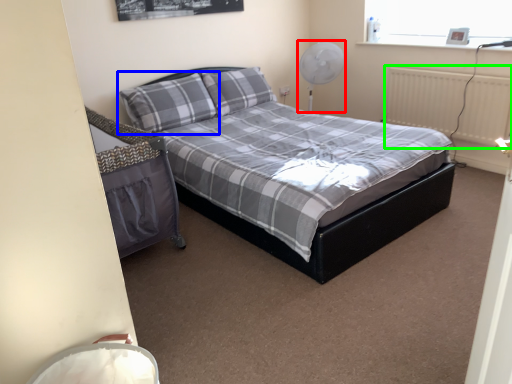
Question: Estimate the real-world distances between objects in this image. Which object is farther from fan (highlighted by a red box), pillow (highlighted by a blue box) or radiator (highlighted by a green box)?

Choices:
 (A) pillow
 (B) radiator

Answer: (A)